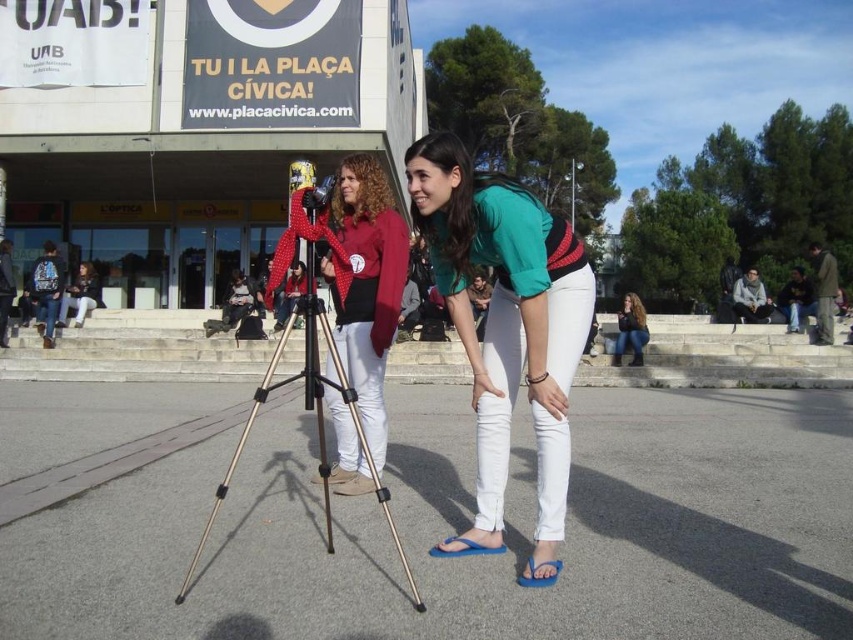
Question: Does white matte pants at center appear under jeans at lower right?

Choices:
 (A) no
 (B) yes

Answer: (B)

Question: Which object is positioned farthest from the jeans at lower right?

Choices:
 (A) matte black jacket at lower left
 (B) white matte pants at center
 (C) black metallic tripod at center
 (D) matte red shirt at center

Answer: (A)

Question: Is matte red shirt at center wider than jeans at lower right?

Choices:
 (A) yes
 (B) no

Answer: (B)

Question: Which of the following is the closest to the observer?

Choices:
 (A) jeans at lower right
 (B) white matte pants at center
 (C) matte red shirt at center

Answer: (B)

Question: Is matte red shirt at center in front of black metallic tripod at center?

Choices:
 (A) yes
 (B) no

Answer: (B)

Question: Which of the following is the closest to the observer?

Choices:
 (A) jeans at lower right
 (B) matte red shirt at center
 (C) black metallic tripod at center

Answer: (C)